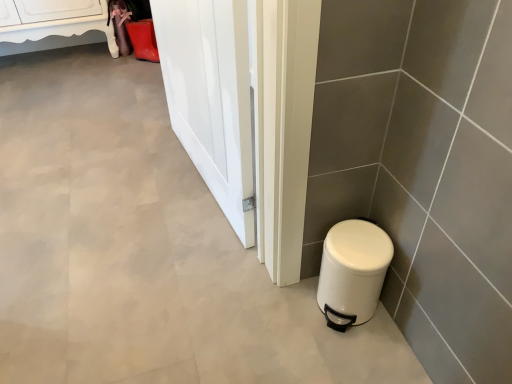
This screenshot has width=512, height=384. Find the location of `free location above white matte trash can at lower right (from a real-world perspective)`. free location above white matte trash can at lower right (from a real-world perspective) is located at coordinates (360, 241).